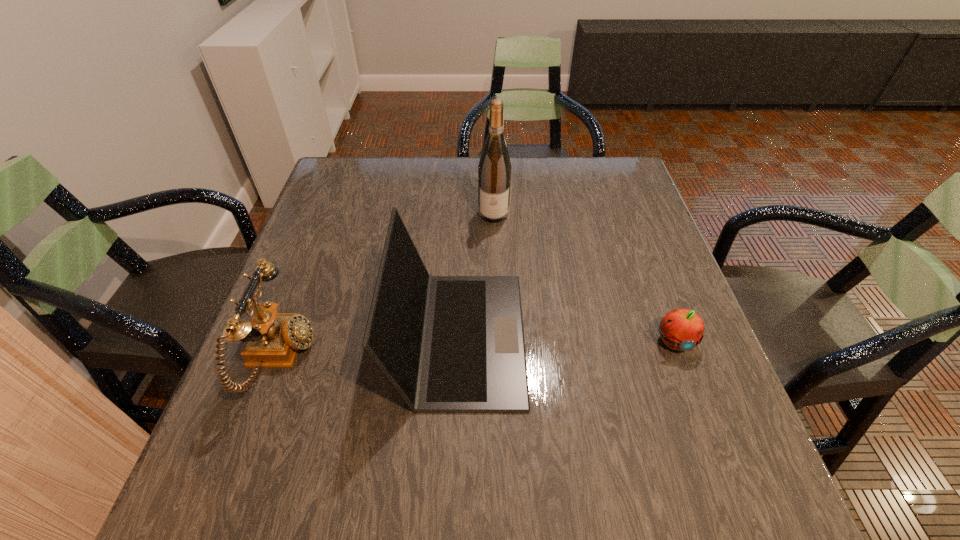
Identify the location of the farthest object. pyautogui.click(x=494, y=170).

The height and width of the screenshot is (540, 960). I want to click on wine bottle, so click(494, 170).

Where is `the third shortest object`? the third shortest object is located at coordinates (446, 343).

You are a GUI agent. You are given a task and a screenshot of the screen. Output one action in this format:
    pyautogui.click(x=<x>, y=<y>)
    Task: Click on the leftmost object
    The height and width of the screenshot is (540, 960).
    Given the screenshot: What is the action you would take?
    pyautogui.click(x=272, y=339)

Find the location of a particular element. The width and height of the screenshot is (960, 540). the third tallest object is located at coordinates (272, 339).

The image size is (960, 540). I want to click on apple, so [x=681, y=329].

This screenshot has width=960, height=540. In order to click on the shortest object in this screenshot , I will do `click(681, 329)`.

Locate an element on the screen. The image size is (960, 540). vacant position located on the right of the farthest object is located at coordinates (545, 213).

Locate an element on the screen. Image resolution: width=960 pixels, height=540 pixels. free space located on the screen of the laptop is located at coordinates (692, 336).

Locate an element on the screen. The image size is (960, 540). vacant space situated 0.320m on the dial number of the leftmost object is located at coordinates (471, 357).